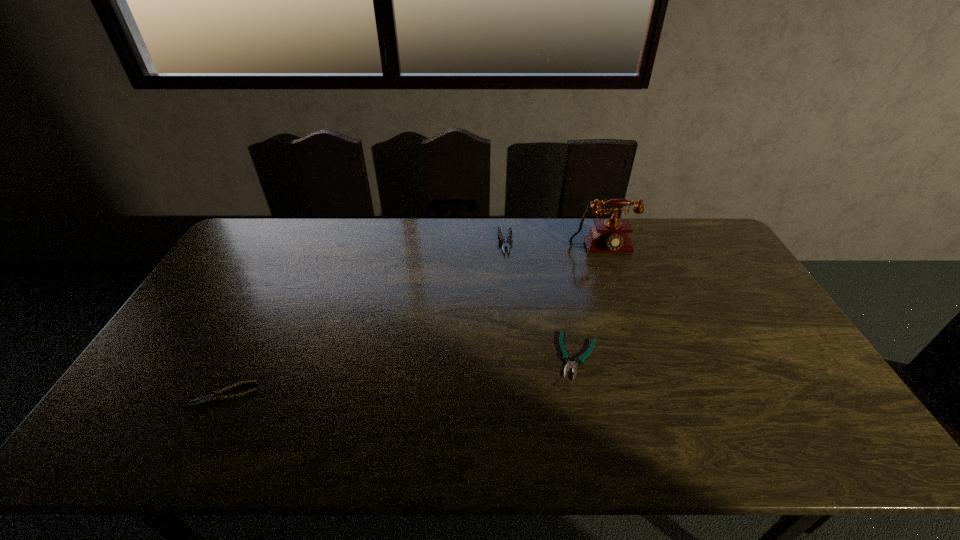
This screenshot has width=960, height=540. Identify the location of telephone. (611, 235).

At what (x,y) coordinates should I click in order to perform the action: click on the second tallest object. Please return your answer as a coordinate pair (x, y). This screenshot has height=540, width=960. Looking at the image, I should click on 509,241.

You are a GUI agent. You are given a task and a screenshot of the screen. Output one action in this format:
    pyautogui.click(x=<x>, y=<y>)
    Task: Click on the second object from left to right
    
    Given the screenshot: What is the action you would take?
    pyautogui.click(x=509, y=241)

In order to click on the nearest pliers in this screenshot , I will do `click(215, 397)`.

This screenshot has width=960, height=540. I want to click on the leftmost object, so click(215, 397).

I want to click on the rightmost pliers, so click(x=566, y=357).

I want to click on the second nearest object, so click(x=566, y=357).

In order to click on free space located on the dial of the telephone in this screenshot , I will do `click(625, 317)`.

At what (x,y) coordinates should I click in order to perform the action: click on vacant area situated at the gripping part of the farthest pliers. Please return your answer as a coordinate pair (x, y). Image resolution: width=960 pixels, height=540 pixels. Looking at the image, I should click on (508, 271).

Locate an element on the screen. The image size is (960, 540). free space located on the back of the leftmost pliers is located at coordinates (276, 295).